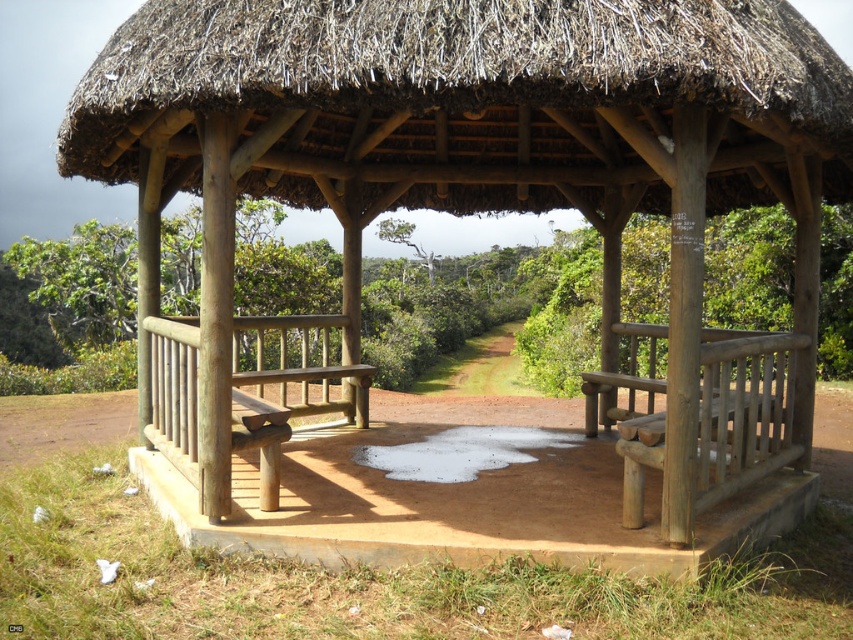
Question: Is thatched straw roof at center bigger than natural wood bench at right?

Choices:
 (A) yes
 (B) no

Answer: (B)

Question: Is thatched straw roof at center wider than natural wood bench at right?

Choices:
 (A) yes
 (B) no

Answer: (B)

Question: Does thatched straw roof at center appear over natural wood bench at right?

Choices:
 (A) no
 (B) yes

Answer: (B)

Question: Which of the following is the closest to the observer?

Choices:
 (A) (721, 451)
 (B) (410, 141)

Answer: (A)